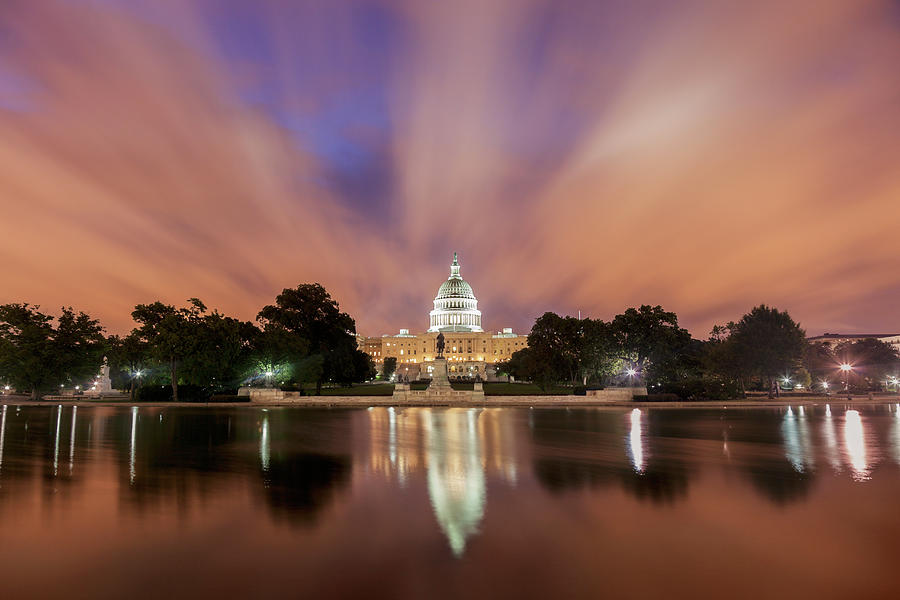
Find the location of a particular element. light is located at coordinates (138, 374).